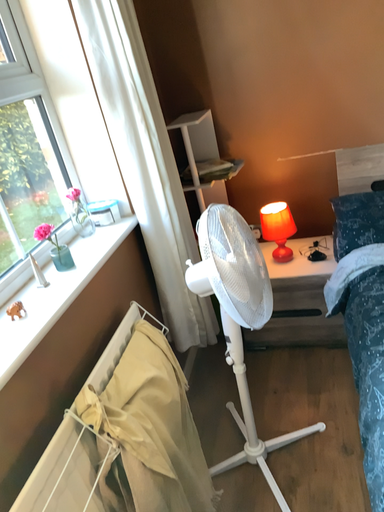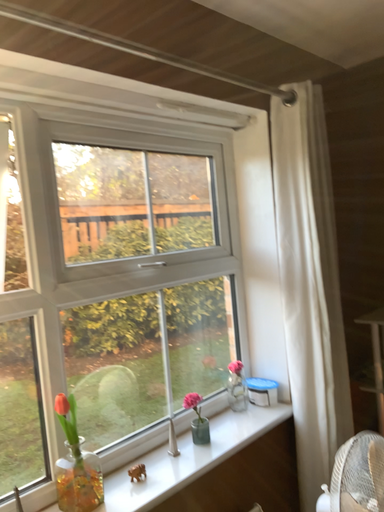
Question: How did the camera likely rotate when shooting the video?

Choices:
 (A) rotated downward
 (B) rotated upward

Answer: (B)